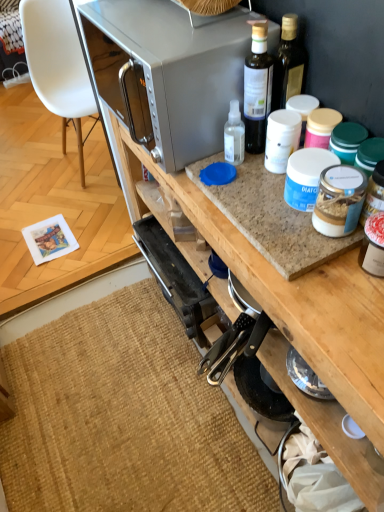
Question: Can you confirm if burlap mat at lower left is wider than translucent plastic bottle at upper center?

Choices:
 (A) no
 (B) yes

Answer: (B)

Question: From the image's perspective, is burlap mat at lower left above translucent plastic bottle at upper center?

Choices:
 (A) no
 (B) yes

Answer: (A)

Question: Is burlap mat at lower left facing towards translucent plastic bottle at upper center?

Choices:
 (A) yes
 (B) no

Answer: (B)

Question: Is burlap mat at lower left positioned in front of translucent plastic bottle at upper center?

Choices:
 (A) yes
 (B) no

Answer: (B)

Question: Is burlap mat at lower left positioned behind translucent plastic bottle at upper center?

Choices:
 (A) yes
 (B) no

Answer: (A)

Question: Is translucent plastic bottle at upper center inside or outside of white plastic chair at left?

Choices:
 (A) inside
 (B) outside

Answer: (B)

Question: Is translucent plastic bottle at upper center to the left or to the right of white plastic chair at left in the image?

Choices:
 (A) left
 (B) right

Answer: (B)

Question: Considering the positions of translucent plastic bottle at upper center and white plastic chair at left in the image, is translucent plastic bottle at upper center wider or thinner than white plastic chair at left?

Choices:
 (A) wide
 (B) thin

Answer: (B)

Question: From their relative heights in the image, would you say translucent plastic bottle at upper center is taller or shorter than white plastic chair at left?

Choices:
 (A) tall
 (B) short

Answer: (B)

Question: From the image's perspective, relative to satin silver microwave at upper center, is burlap mat at lower left above or below?

Choices:
 (A) above
 (B) below

Answer: (B)

Question: Considering the positions of point (x=9, y=366) and point (x=163, y=108), is point (x=9, y=366) closer or farther from the camera than point (x=163, y=108)?

Choices:
 (A) farther
 (B) closer

Answer: (A)

Question: From a real-world perspective, is burlap mat at lower left positioned above or below satin silver microwave at upper center?

Choices:
 (A) below
 (B) above

Answer: (A)

Question: In the image, is burlap mat at lower left positioned in front of or behind satin silver microwave at upper center?

Choices:
 (A) behind
 (B) front

Answer: (A)

Question: Is translucent plastic bottle at upper center bigger or smaller than burlap mat at lower left?

Choices:
 (A) small
 (B) big

Answer: (A)

Question: Would you say translucent plastic bottle at upper center is inside or outside burlap mat at lower left?

Choices:
 (A) outside
 (B) inside

Answer: (A)